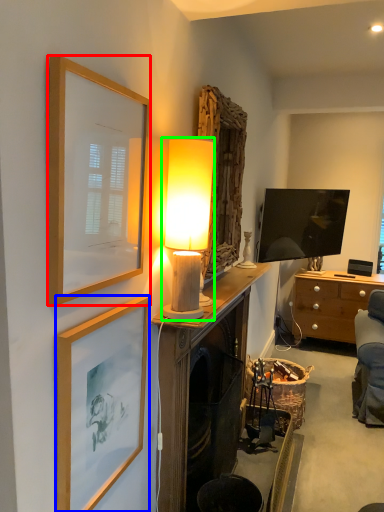
Question: Which is nearer to the picture frame (highlighted by a red box)? picture frame (highlighted by a blue box) or lamp (highlighted by a green box).

Choices:
 (A) picture frame
 (B) lamp

Answer: (A)